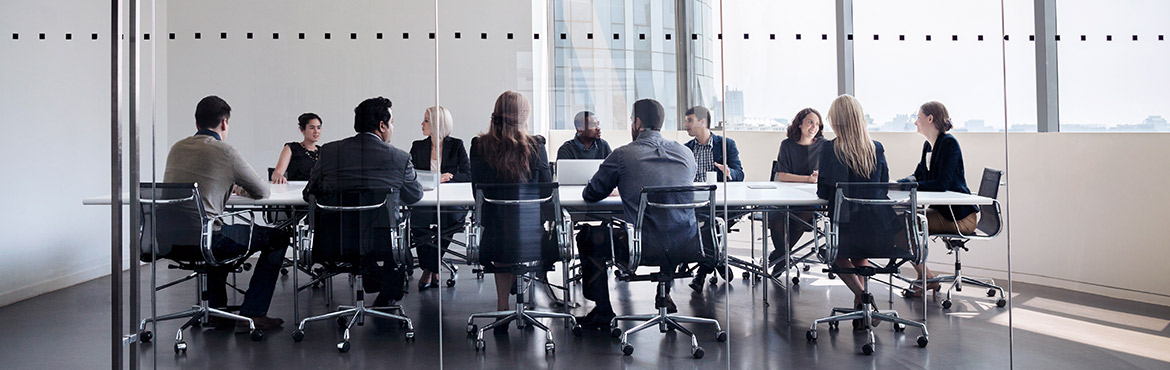
You are a GUI agent. You are given a task and a screenshot of the screen. Output one action in this format:
    pyautogui.click(x=<x>, y=<y>)
    Task: Click on the office chairs
    
    Given the screenshot: What is the action you would take?
    pyautogui.click(x=154, y=219), pyautogui.click(x=349, y=230), pyautogui.click(x=515, y=230), pyautogui.click(x=666, y=233), pyautogui.click(x=895, y=219), pyautogui.click(x=986, y=175), pyautogui.click(x=274, y=216)